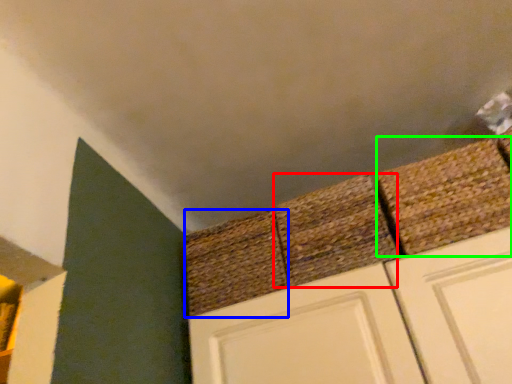
Question: Which is nearer to the brick (highlighted by a red box)? brick (highlighted by a blue box) or brick (highlighted by a green box).

Choices:
 (A) brick
 (B) brick

Answer: (A)